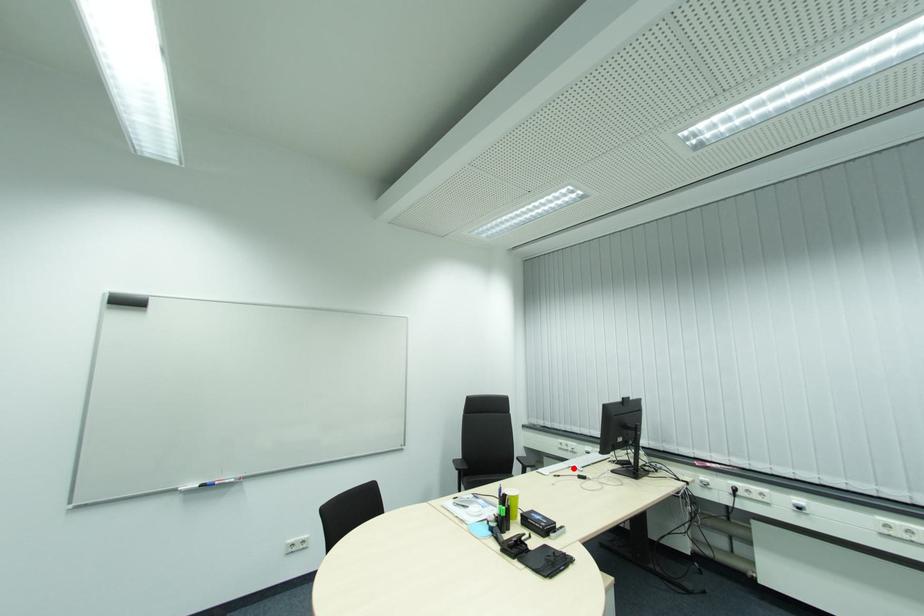
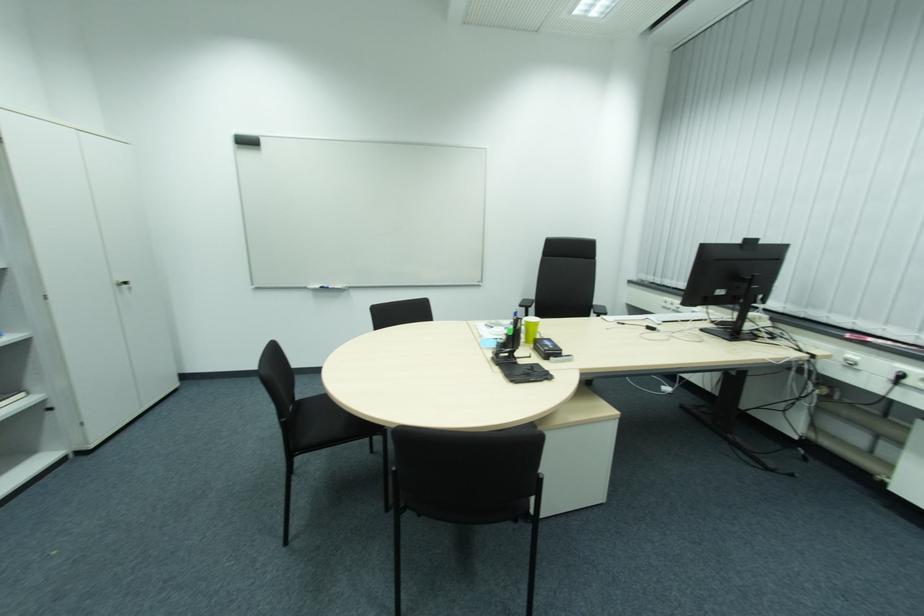
Where in the second image is the point corresponding to the highlighted location from the first image?

(650, 321)